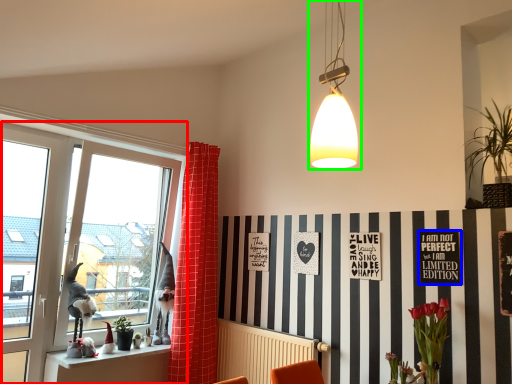
Question: Based on their relative distances, which object is nearer to window (highlighted by a red box)? Choose from bulletin board (highlighted by a blue box) and lamp (highlighted by a green box).

Choices:
 (A) bulletin board
 (B) lamp

Answer: (B)